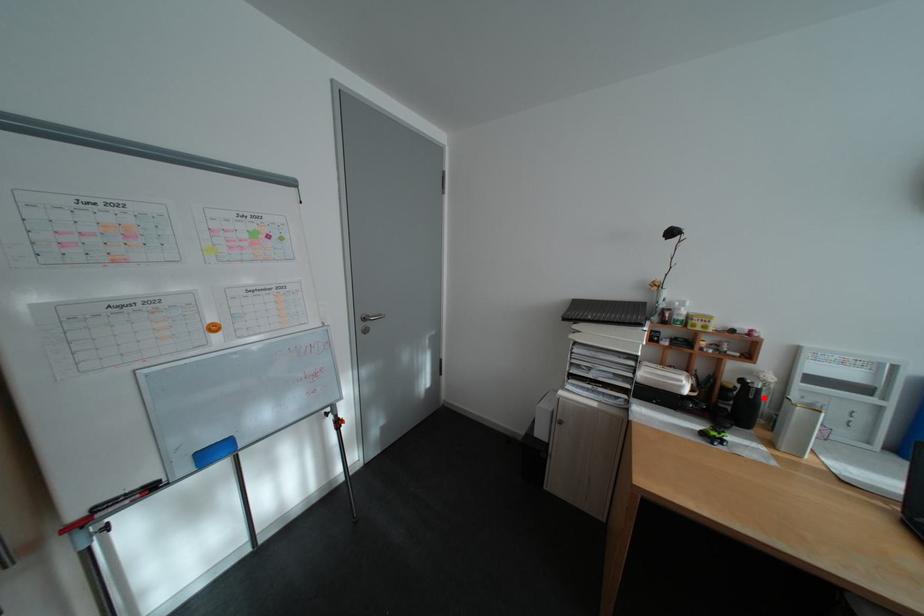
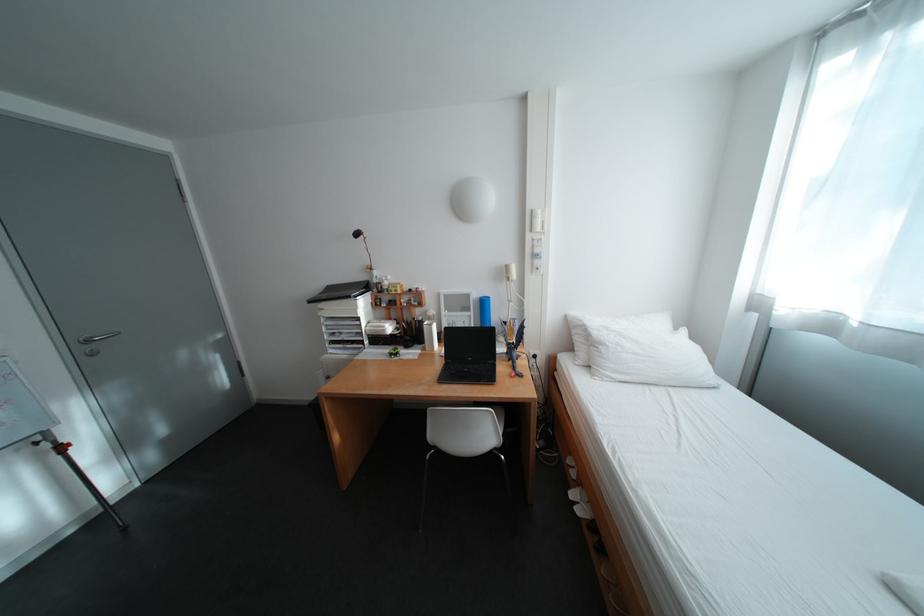
Locate, in the second image, the point that corresponds to the highlighted location in the first image.

(430, 326)